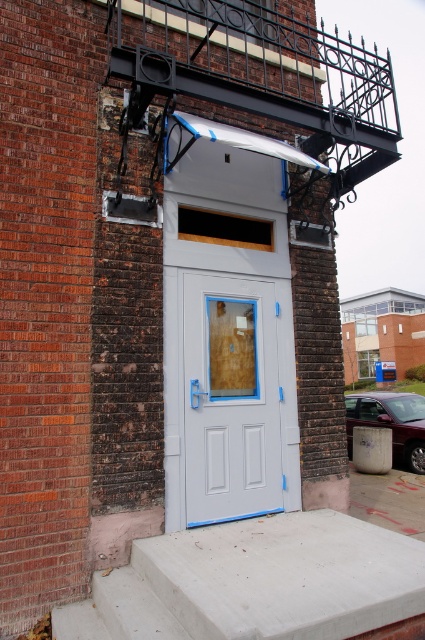
Does concrete at lower center have a lesser width compared to white painted wood door at center?

In fact, concrete at lower center might be wider than white painted wood door at center.

Does concrete at lower center appear on the right side of white painted wood door at center?

Yes, concrete at lower center is to the right of white painted wood door at center.

Is point (357, 540) positioned after point (226, 436)?

No, (357, 540) is in front of (226, 436).

In order to click on concrete at lower center in this screenshot , I will do `click(255, 582)`.